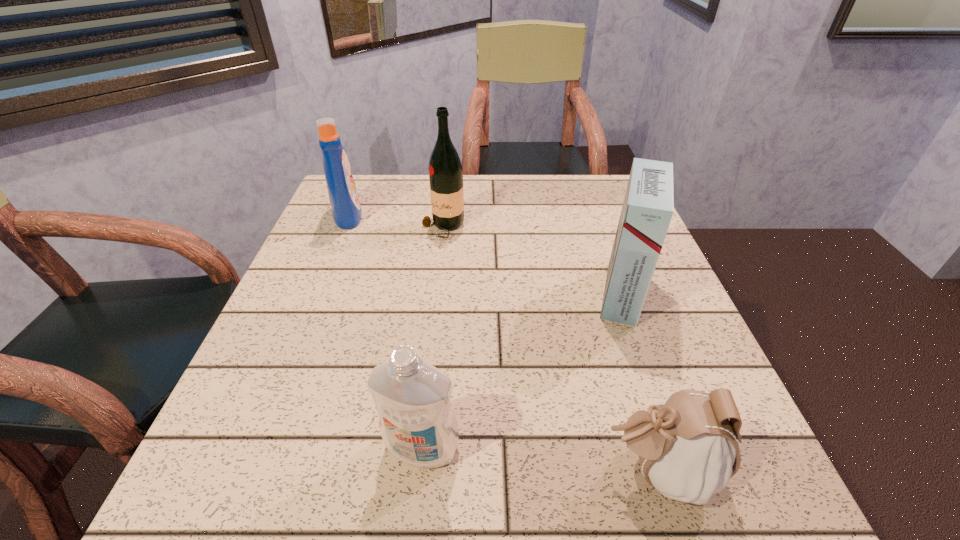
Locate an element on the screen. Image resolution: width=960 pixels, height=540 pixels. blank space that satisfies the following two spatial constraints: 1. on the back side of the cigarette case; 2. on the label of the taller detergent is located at coordinates (593, 215).

Identify the location of free space that satisfies the following two spatial constraints: 1. on the label of the farther detergent; 2. on the left side of the wine bottle. Image resolution: width=960 pixels, height=540 pixels. (343, 228).

Identify the location of free space that satisfies the following two spatial constraints: 1. on the label of the left detergent; 2. on the left side of the nearer detergent. The height and width of the screenshot is (540, 960). (253, 447).

Locate an element on the screen. This screenshot has height=540, width=960. blank space that satisfies the following two spatial constraints: 1. on the label of the farther detergent; 2. on the back side of the nearer detergent is located at coordinates (253, 447).

Identify the location of free space in the image that satisfies the following two spatial constraints: 1. on the label of the left detergent; 2. on the back side of the third farthest object. (316, 293).